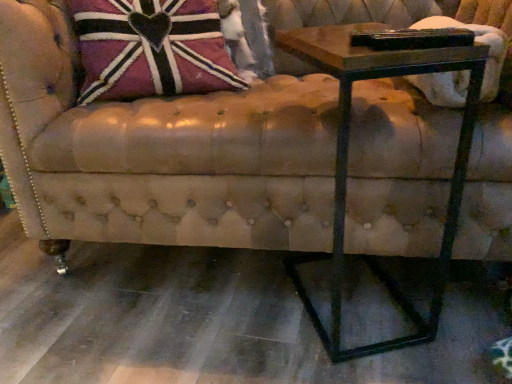
Question: Is wooden table at right located outside leather-like union jack pillow at upper left?

Choices:
 (A) yes
 (B) no

Answer: (A)

Question: From a real-world perspective, is wooden table at right on leather-like union jack pillow at upper left?

Choices:
 (A) no
 (B) yes

Answer: (A)

Question: From the image's perspective, is wooden table at right over leather-like union jack pillow at upper left?

Choices:
 (A) yes
 (B) no

Answer: (B)

Question: Can you confirm if wooden table at right is thinner than leather-like union jack pillow at upper left?

Choices:
 (A) no
 (B) yes

Answer: (A)

Question: Does wooden table at right appear on the right side of leather-like union jack pillow at upper left?

Choices:
 (A) no
 (B) yes

Answer: (B)

Question: Is leather couch at center situated inside wooden table at right or outside?

Choices:
 (A) outside
 (B) inside

Answer: (A)

Question: In terms of height, does leather couch at center look taller or shorter compared to wooden table at right?

Choices:
 (A) short
 (B) tall

Answer: (B)

Question: Looking at their shapes, would you say leather couch at center is wider or thinner than wooden table at right?

Choices:
 (A) thin
 (B) wide

Answer: (B)

Question: Relative to wooden table at right, is leather couch at center in front or behind?

Choices:
 (A) front
 (B) behind

Answer: (B)

Question: Based on their sizes in the image, would you say wooden table at right is bigger or smaller than leather-like union jack pillow at upper left?

Choices:
 (A) big
 (B) small

Answer: (A)

Question: Considering the positions of wooden table at right and leather-like union jack pillow at upper left in the image, is wooden table at right taller or shorter than leather-like union jack pillow at upper left?

Choices:
 (A) tall
 (B) short

Answer: (A)

Question: Looking at their shapes, would you say wooden table at right is wider or thinner than leather-like union jack pillow at upper left?

Choices:
 (A) wide
 (B) thin

Answer: (A)

Question: From the image's perspective, is wooden table at right above or below leather-like union jack pillow at upper left?

Choices:
 (A) below
 (B) above

Answer: (A)

Question: From their relative heights in the image, would you say wooden table at right is taller or shorter than leather couch at center?

Choices:
 (A) tall
 (B) short

Answer: (B)

Question: Is wooden table at right in front of or behind leather couch at center in the image?

Choices:
 (A) front
 (B) behind

Answer: (A)